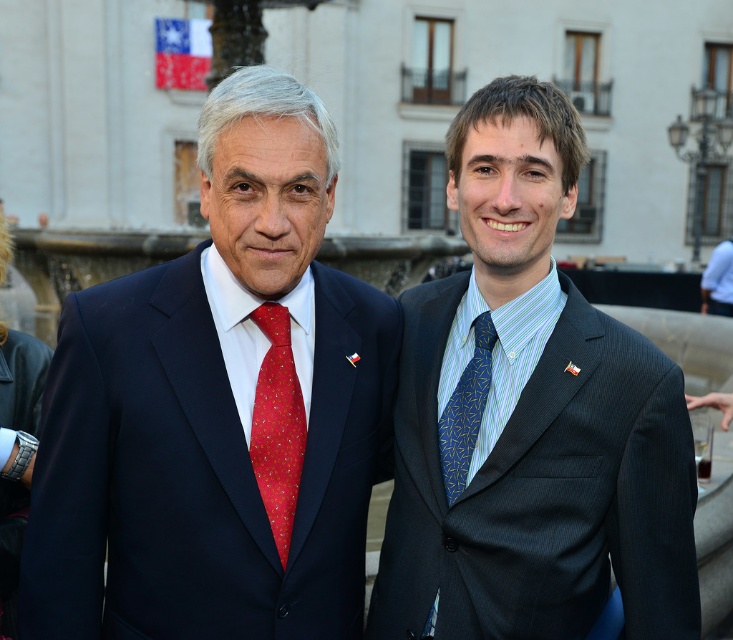
You are a photographer positioned at the front of the scene. You need to focus your camera on the matte black suit at left and the blue silk tie at right. Which object should you adjust your focus on first to ensure both are in sharp focus?

The matte black suit at left is closer to the viewer than the blue silk tie at right, so you should focus on the matte black suit at left first to ensure both are in sharp focus.

You are a photographer at the event and want to ensure both the matte black suit at left and the red silk tie at center are visible in your photo. Given that the camera can only focus on objects taller than 1.5 meters, will both items be in focus?

The matte black suit at left is not as tall as the red silk tie at center, but since the red silk tie at center is taller than 1.5 meters, both items will be in focus as the camera can focus on them.